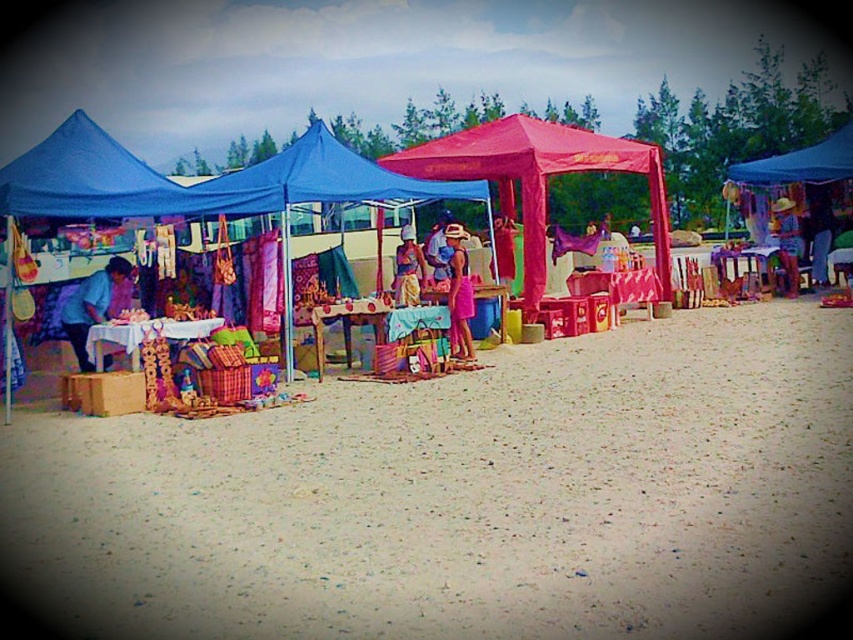
Question: Which point is closer to the camera taking this photo?

Choices:
 (A) 252,202
 (B) 465,156
 (C) 193,497

Answer: (C)

Question: Which point appears farthest from the camera in this image?

Choices:
 (A) (357, 189)
 (B) (102, 305)
 (C) (427, 161)
 (D) (325, 508)

Answer: (C)

Question: Does beige sandy beach at center appear over matte pink fabric tent at center?

Choices:
 (A) no
 (B) yes

Answer: (A)

Question: Observing the image, what is the correct spatial positioning of beige sandy beach at center in reference to matte purple fabric at left?

Choices:
 (A) below
 (B) above

Answer: (A)

Question: Can you confirm if matte pink fabric tent at center is wider than matte purple fabric at left?

Choices:
 (A) yes
 (B) no

Answer: (A)

Question: Based on their relative distances, which object is nearer to the pink fabric canopy at center?

Choices:
 (A) matte pink fabric tent at center
 (B) matte purple fabric at left
 (C) beige sandy beach at center

Answer: (A)